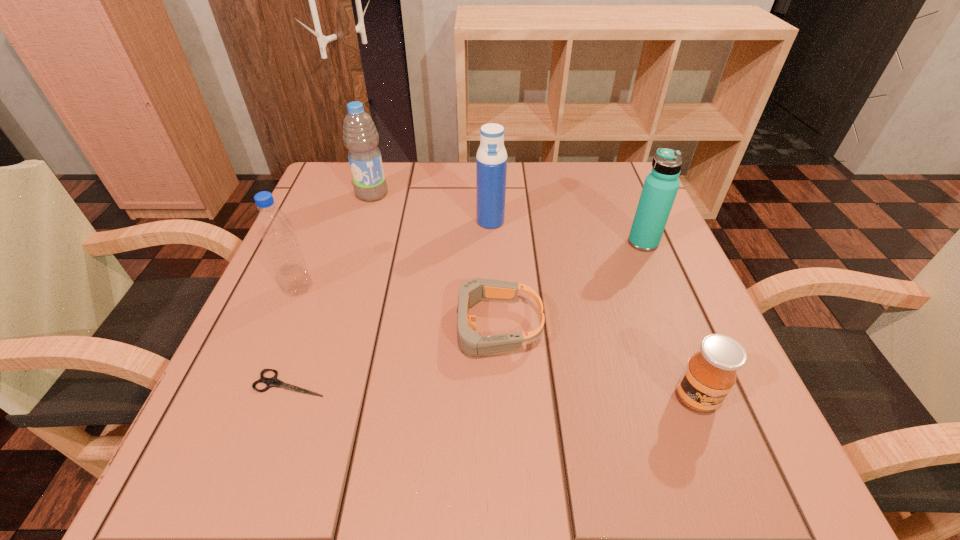
Locate an element on the screen. The width and height of the screenshot is (960, 540). the farthest object is located at coordinates click(x=361, y=138).

Identify the location of the farthest water bottle. Image resolution: width=960 pixels, height=540 pixels. (361, 138).

You are a GUI agent. You are given a task and a screenshot of the screen. Output one action in this format:
    pyautogui.click(x=<x>, y=<y>)
    Task: Click on the second water bottle from right to left
    The image size is (960, 540).
    Given the screenshot: What is the action you would take?
    [491, 160]

You are a GUI agent. You are given a task and a screenshot of the screen. Output one action in this format:
    pyautogui.click(x=<x>, y=<y>)
    Task: Click on the sixth nearest object
    The height and width of the screenshot is (540, 960).
    Given the screenshot: What is the action you would take?
    pyautogui.click(x=491, y=160)

You are a GUI agent. You are given a task and a screenshot of the screen. Output one action in this format:
    pyautogui.click(x=<x>, y=<y>)
    Task: Click on the second nearest water bottle
    The height and width of the screenshot is (540, 960).
    Given the screenshot: What is the action you would take?
    pyautogui.click(x=660, y=188)

This screenshot has width=960, height=540. I want to click on the rightmost water bottle, so click(x=660, y=188).

Locate an element on the screen. Image resolution: width=960 pixels, height=540 pixels. the leftmost water bottle is located at coordinates (274, 227).

The image size is (960, 540). What are the coordinates of `honey` in the screenshot? It's located at (710, 374).

Where is `goggles`? The width and height of the screenshot is (960, 540). goggles is located at coordinates (471, 343).

Where is `the shortest object`? The width and height of the screenshot is (960, 540). the shortest object is located at coordinates (273, 381).